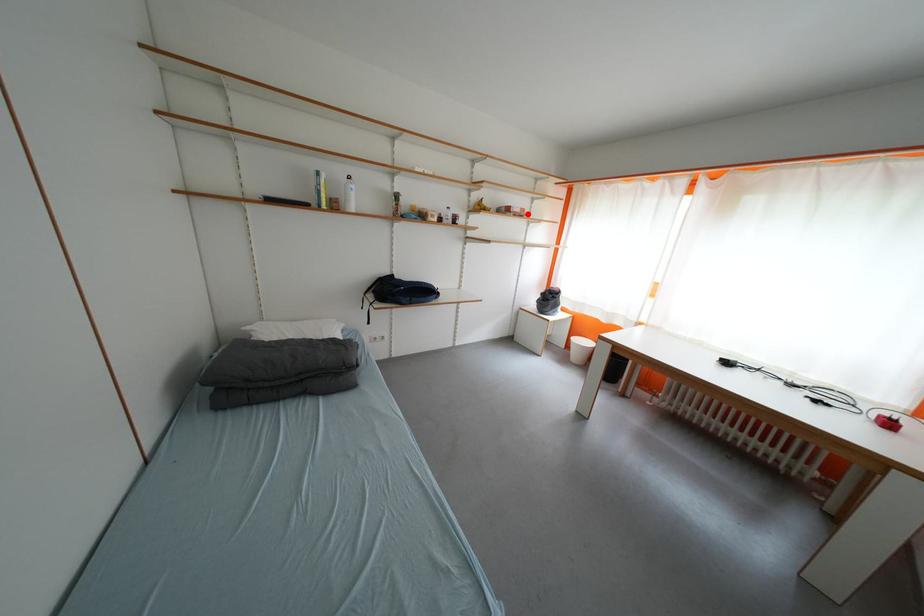
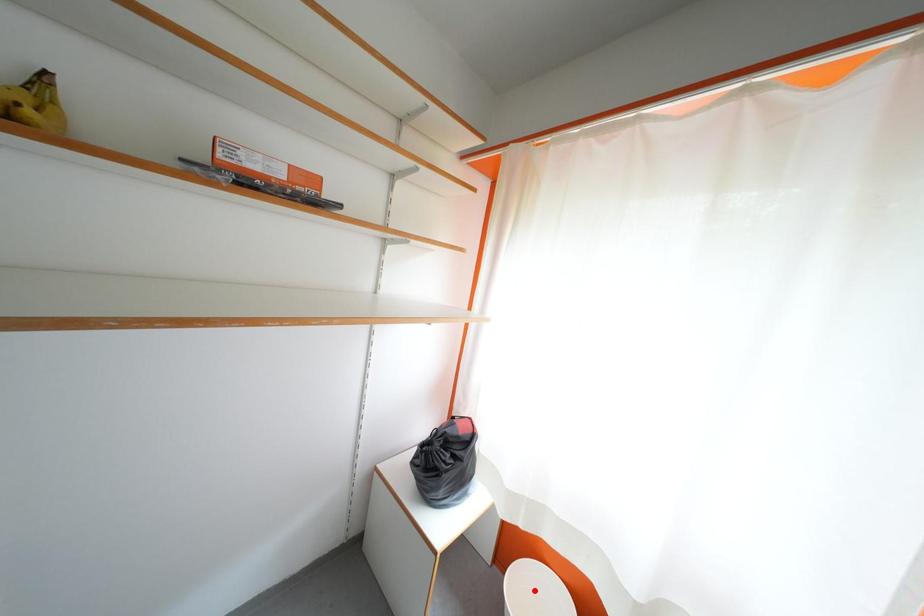
I am providing you with two images of the same scene from different viewpoints. A red point is marked on the first image and another point is marked on the second image. Do the highlighted points in image1 and image2 indicate the same real-world spot?

No